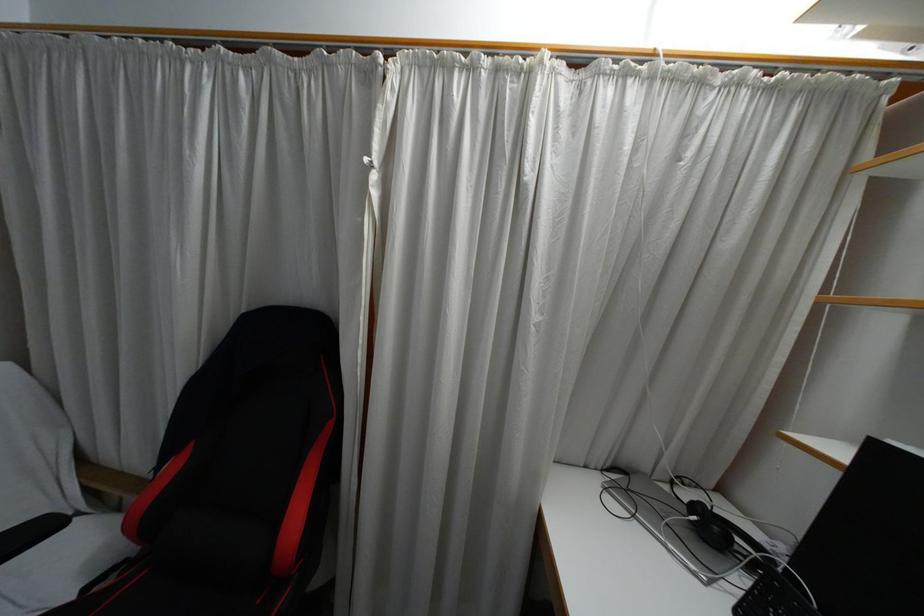
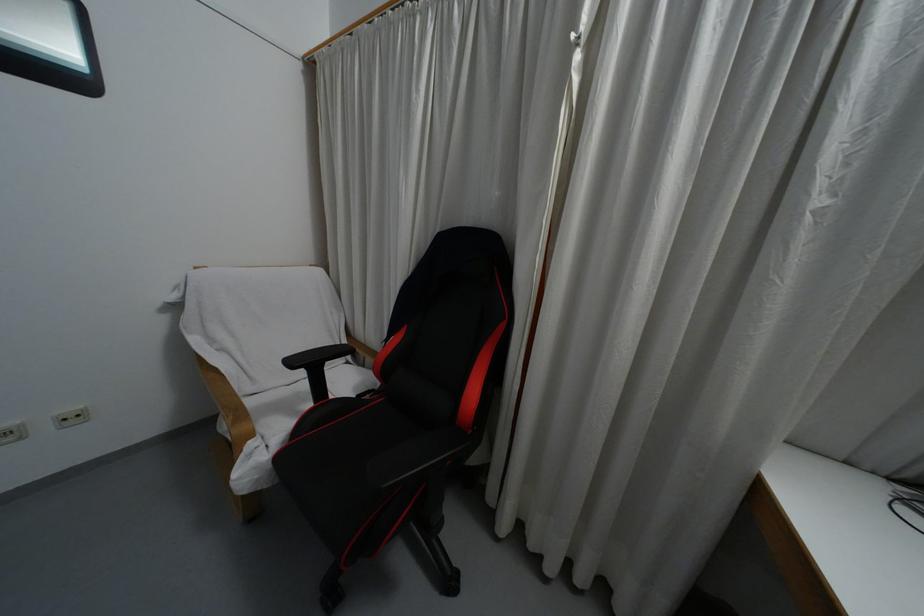
Question: The images are taken continuously from a first-person perspective. In which direction is your viewpoint rotating?

Choices:
 (A) Left
 (B) Right
 (C) Up
 (D) Down

Answer: (A)